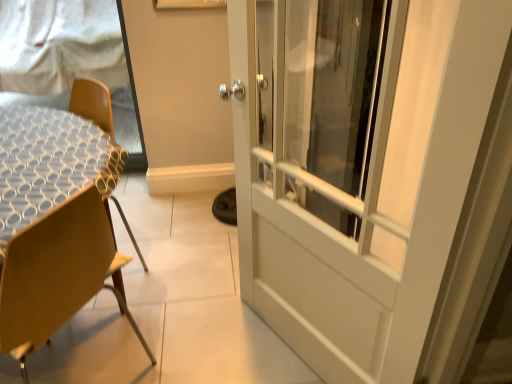
Where is `vacant area that is situated to the right of wooden chair at left`? The width and height of the screenshot is (512, 384). vacant area that is situated to the right of wooden chair at left is located at coordinates (208, 336).